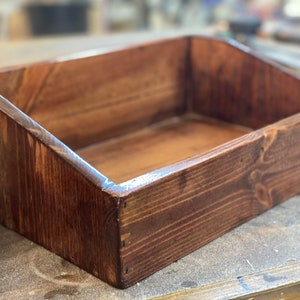
You are a GUI agent. You are given a task and a screenshot of the screen. Output one action in this format:
    pyautogui.click(x=<x>, y=<y>)
    Task: Click on the bottom inside of wooden box
    This screenshot has height=300, width=300.
    Given the screenshot: What is the action you would take?
    pyautogui.click(x=178, y=143)